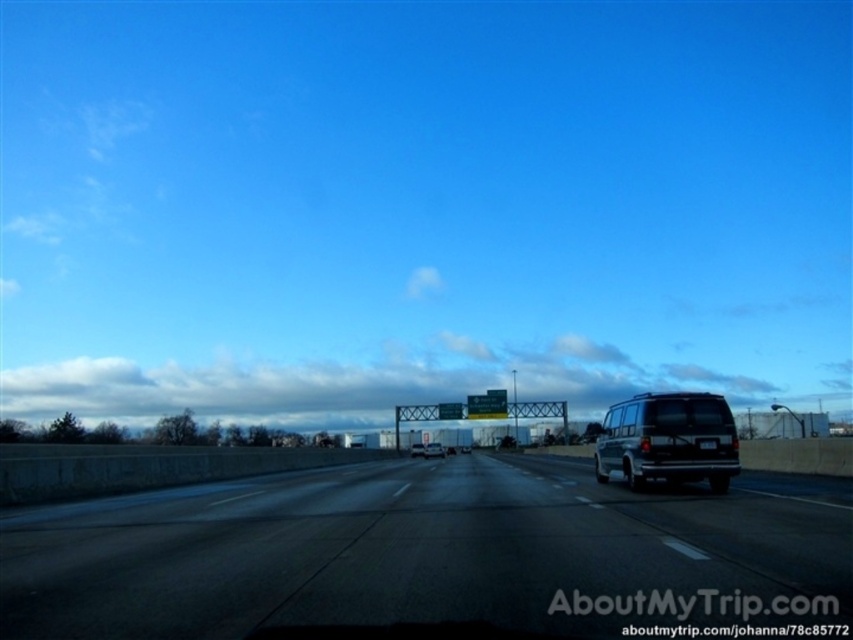
You are driving a car and see the black asphalt highway at center and the matte black van at center. Which object takes up more space in the image?

The black asphalt highway at center is larger in size than the matte black van at center, so it takes up more space in the image.

You are a driver approaching the black asphalt highway at center and the silver metallic van at center. Which object will you encounter first?

The black asphalt highway at center is closer to the viewer than the silver metallic van at center, so you will encounter the black asphalt highway at center first.

You are standing at the center of the image. Looking at the black asphalt highway at center, can you tell me its 2D coordinates in the image?

The 2D coordinates of the black asphalt highway at center are at point (422, 554).